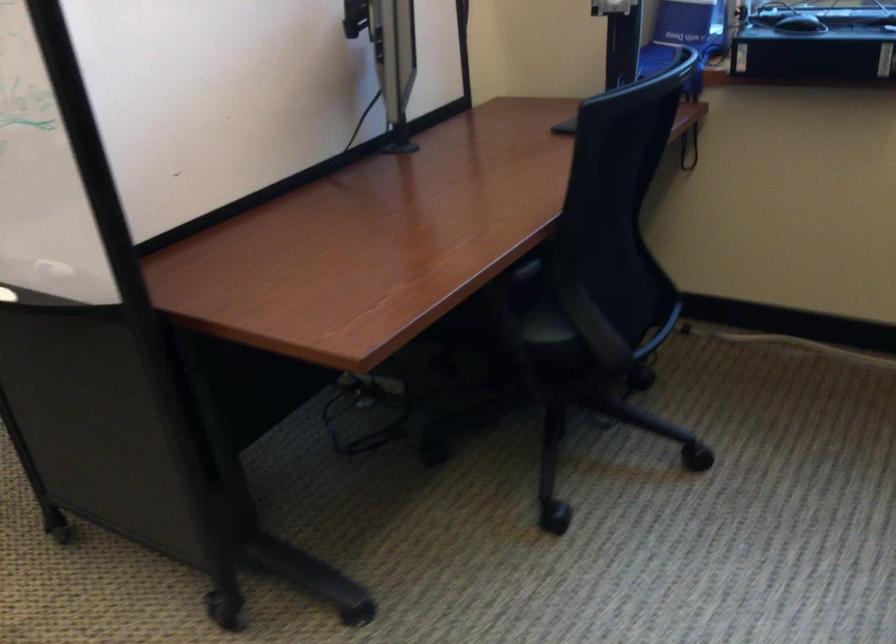
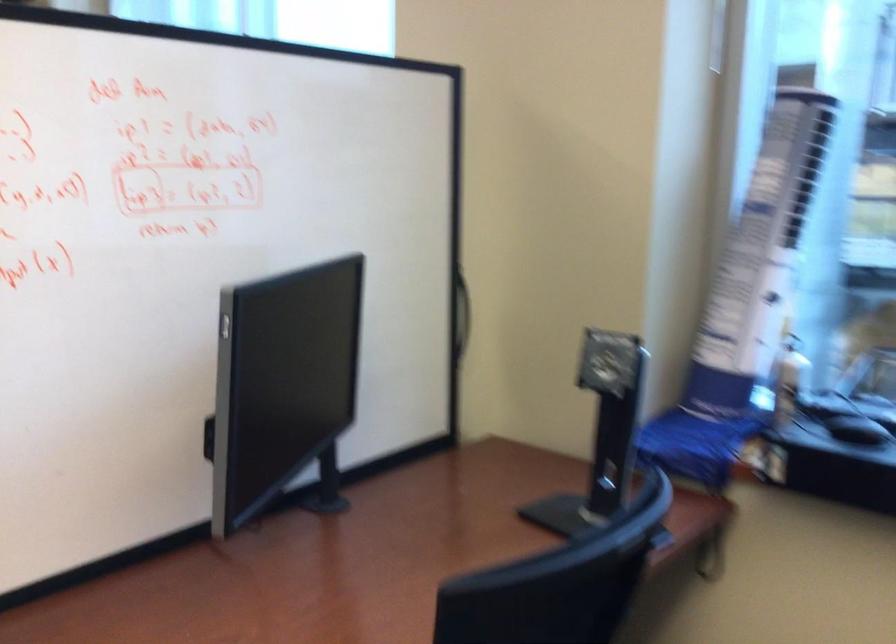
Question: How did the camera likely rotate?

Choices:
 (A) Left
 (B) Right
 (C) Up
 (D) Down

Answer: (C)